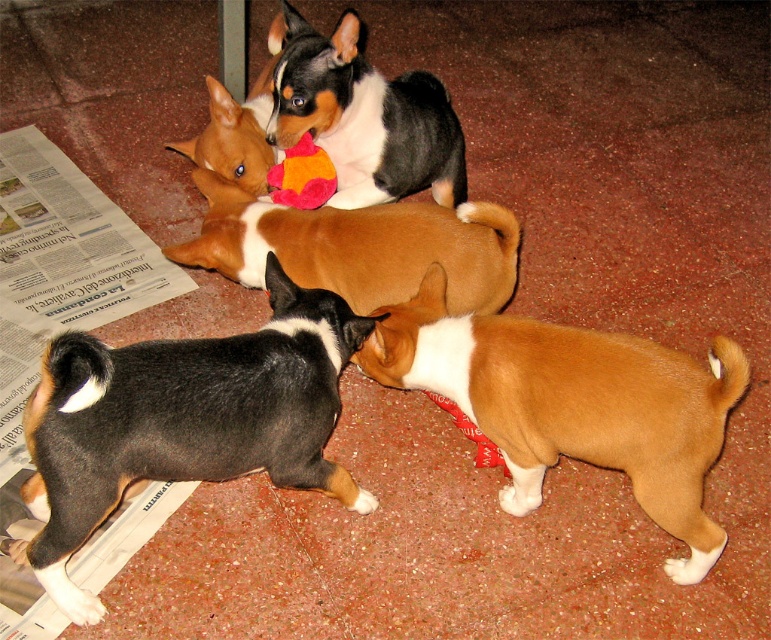
Locate an element on the screen. black and white fur at center is located at coordinates (365, 116).

Is black and white fur at center closer to camera compared to brown fur at upper left?

Yes, black and white fur at center is in front of brown fur at upper left.

I want to click on black and white fur at center, so click(365, 116).

Can you confirm if black and tan fur at lower left is thinner than red plush toy at center?

No.

Between point (106, 372) and point (466, 422), which one is positioned in front?

Point (106, 372) is more forward.

Who is more distant from viewer, (x=83, y=541) or (x=495, y=458)?

Positioned behind is point (x=495, y=458).

The image size is (771, 640). Find the location of `black and tan fur at lower left`. black and tan fur at lower left is located at coordinates (183, 420).

Does soft plush toy at center have a greater height compared to red plush toy at center?

Indeed, soft plush toy at center has a greater height compared to red plush toy at center.

You are a GUI agent. You are given a task and a screenshot of the screen. Output one action in this format:
    pyautogui.click(x=<x>, y=<y>)
    Task: Click on the soft plush toy at center
    The width and height of the screenshot is (771, 640).
    Given the screenshot: What is the action you would take?
    pyautogui.click(x=302, y=176)

Locate an element on the screen. The height and width of the screenshot is (640, 771). soft plush toy at center is located at coordinates (302, 176).